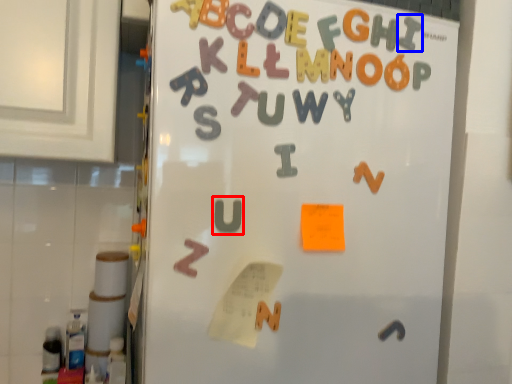
Question: Which point is further to the camera, letter (highlighted by a red box) or letter (highlighted by a blue box)?

Choices:
 (A) letter
 (B) letter

Answer: (B)